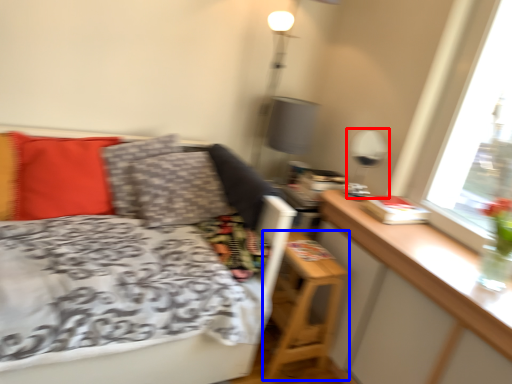
Question: Which point is further to the camera, table lamp (highlighted by a red box) or nightstand (highlighted by a blue box)?

Choices:
 (A) table lamp
 (B) nightstand

Answer: (A)